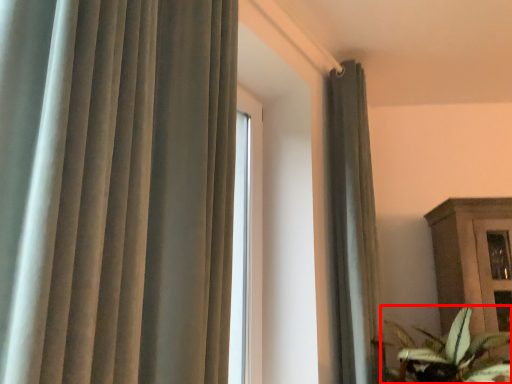
Question: From the image's perspective, where is houseplant (annotated by the red box) located relative to curtain?

Choices:
 (A) above
 (B) below

Answer: (B)